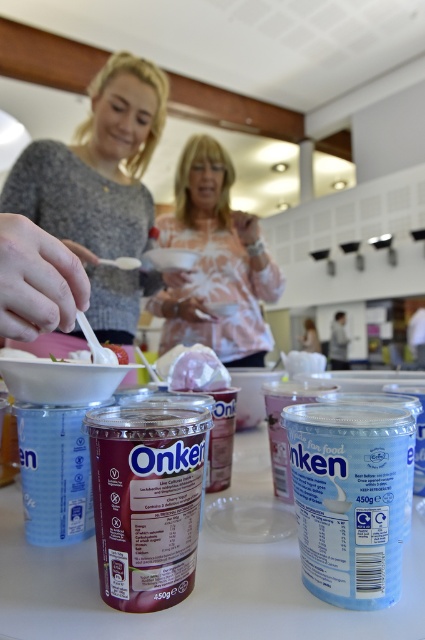
Question: Considering the real-world distances, which object is closest to the matte gray sweater at upper left?

Choices:
 (A) blue plastic tub at center
 (B) translucent plastic cups at center
 (C) metallic purple can at center
 (D) pink tie-dye shirt at center

Answer: (D)

Question: Is metallic purple can at center to the left of white matte chicken at center from the viewer's perspective?

Choices:
 (A) yes
 (B) no

Answer: (A)

Question: Is matte gray sweater at upper left positioned before pink tie-dye shirt at center?

Choices:
 (A) yes
 (B) no

Answer: (A)

Question: Which object is positioned farthest from the pink tie-dye shirt at center?

Choices:
 (A) metallic purple can at center
 (B) translucent plastic cups at center
 (C) blue plastic tub at center

Answer: (A)

Question: Which object appears farthest from the camera in this image?

Choices:
 (A) matte gray sweater at upper left
 (B) white matte chicken at center

Answer: (A)

Question: Is translucent plastic cups at center positioned before blue plastic tub at center?

Choices:
 (A) no
 (B) yes

Answer: (B)